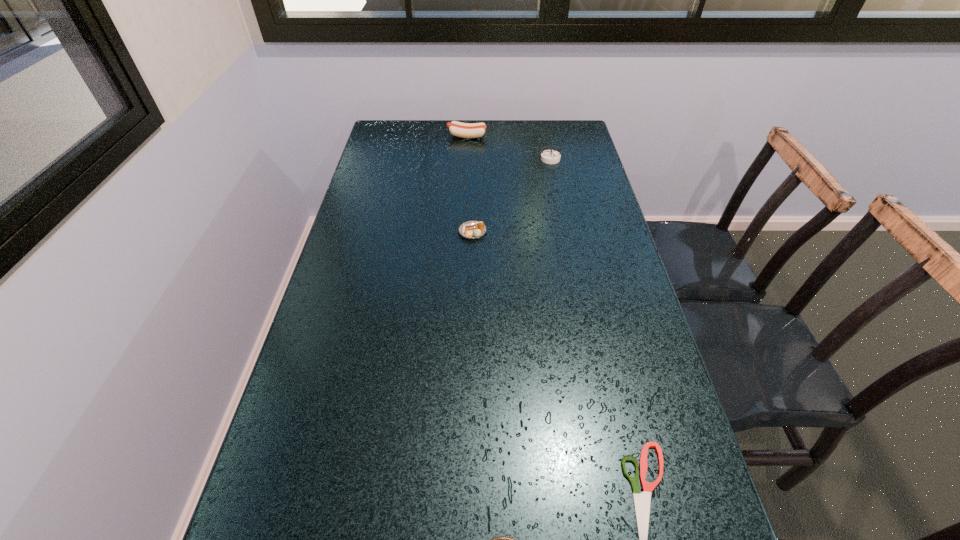
Where is `free space that is in between the right compass and the third nearest object`? The image size is (960, 540). free space that is in between the right compass and the third nearest object is located at coordinates (512, 195).

Where is `empty space that is in between the sausage and the third tallest object`? empty space that is in between the sausage and the third tallest object is located at coordinates (469, 184).

Locate an element on the screen. the closest object to the nearer compass is located at coordinates (642, 501).

Image resolution: width=960 pixels, height=540 pixels. In order to click on object that stands as the closest to the nearer compass in this screenshot , I will do 642,501.

Where is `vacant space that satisfies the following two spatial constraints: 1. on the front side of the sausage; 2. on the left side of the third tallest object`? vacant space that satisfies the following two spatial constraints: 1. on the front side of the sausage; 2. on the left side of the third tallest object is located at coordinates (463, 232).